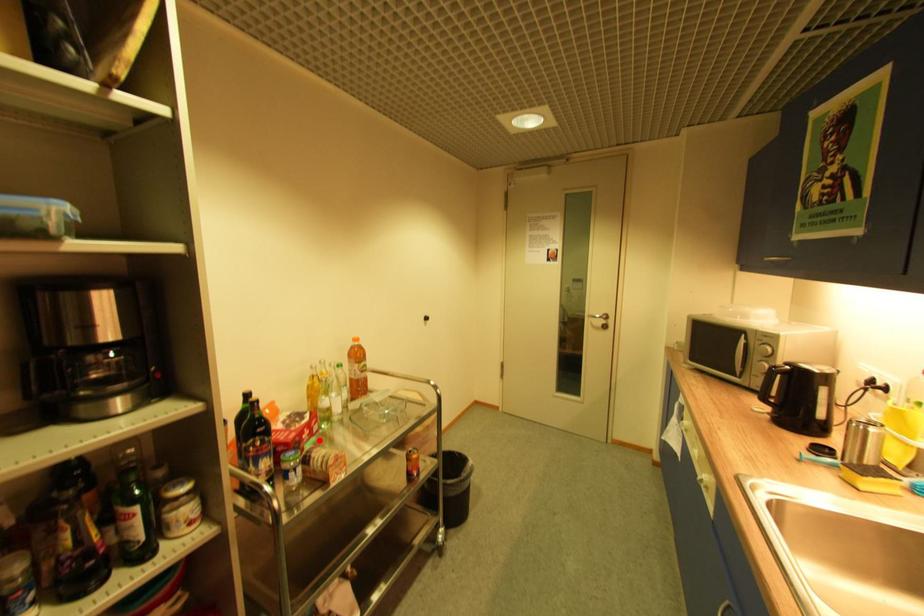
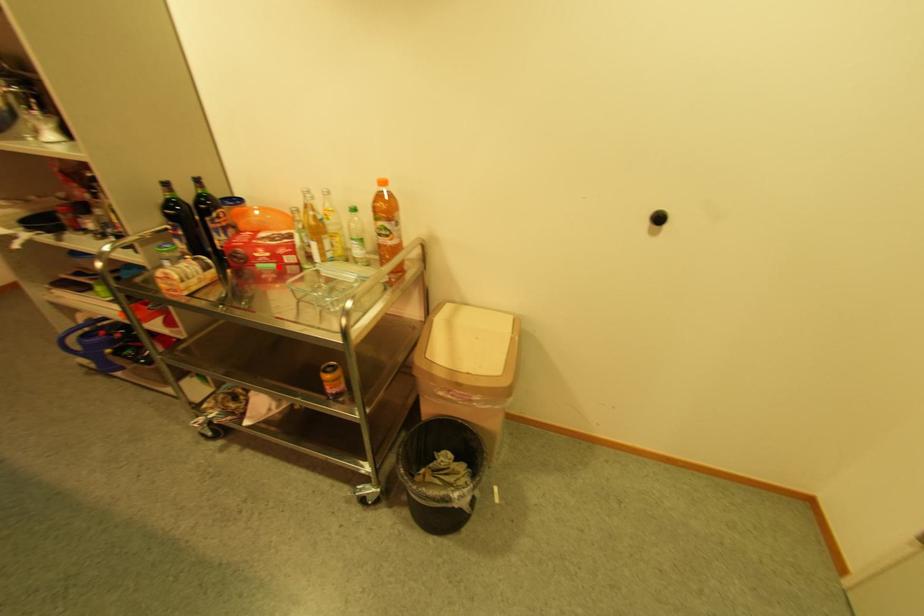
I am providing you with two images of the same scene from different viewpoints. A red point is marked on the first image and another point is marked on the second image. Does the point marked in image1 correspond to the same location as the one in image2?

Yes